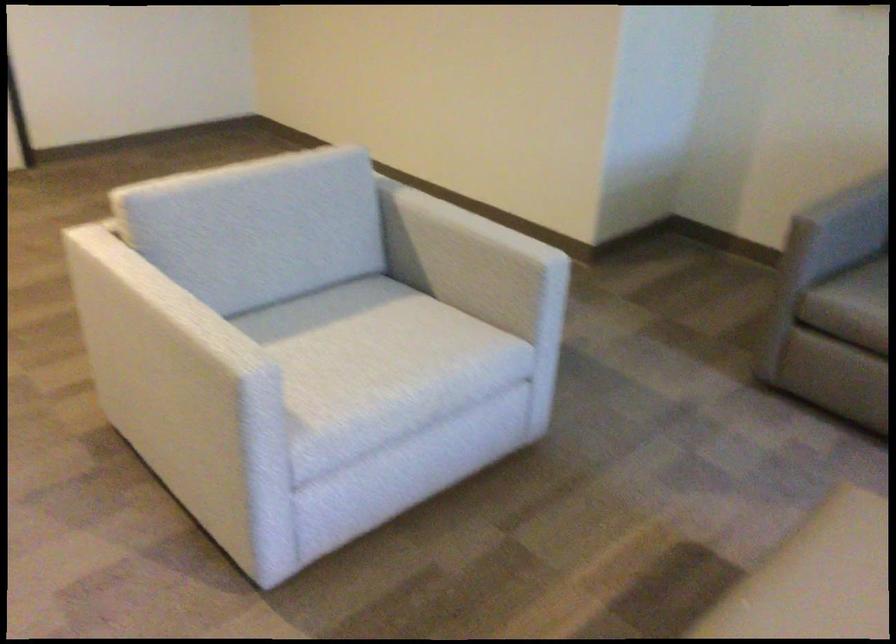
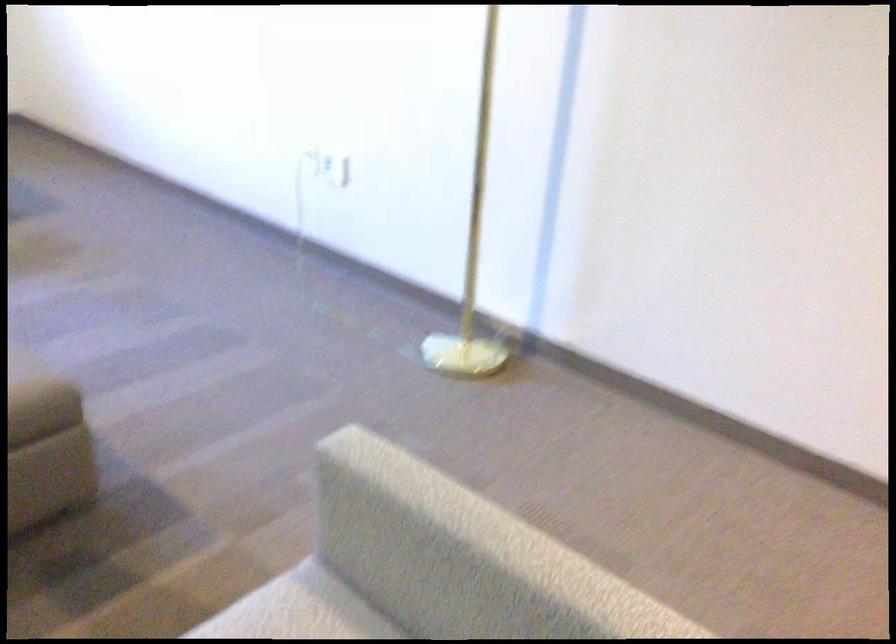
Find the pixel in the second image that matches point 204,339 in the first image.

(421, 489)